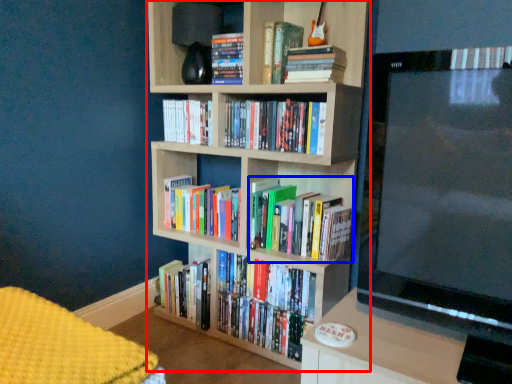
Question: Which of the following is the closest to the observer, bookcase (highlighted by a red box) or book (highlighted by a blue box)?

Choices:
 (A) bookcase
 (B) book

Answer: (A)